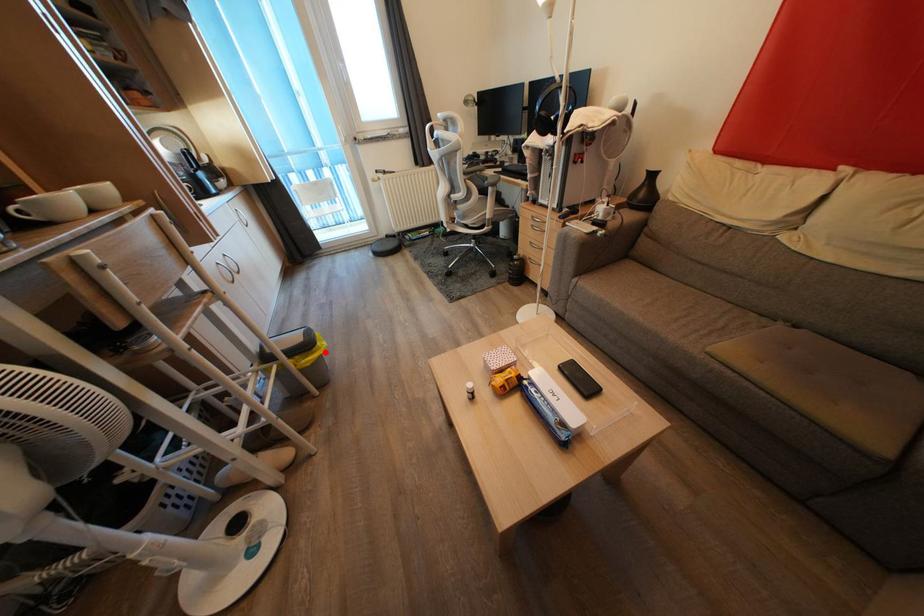
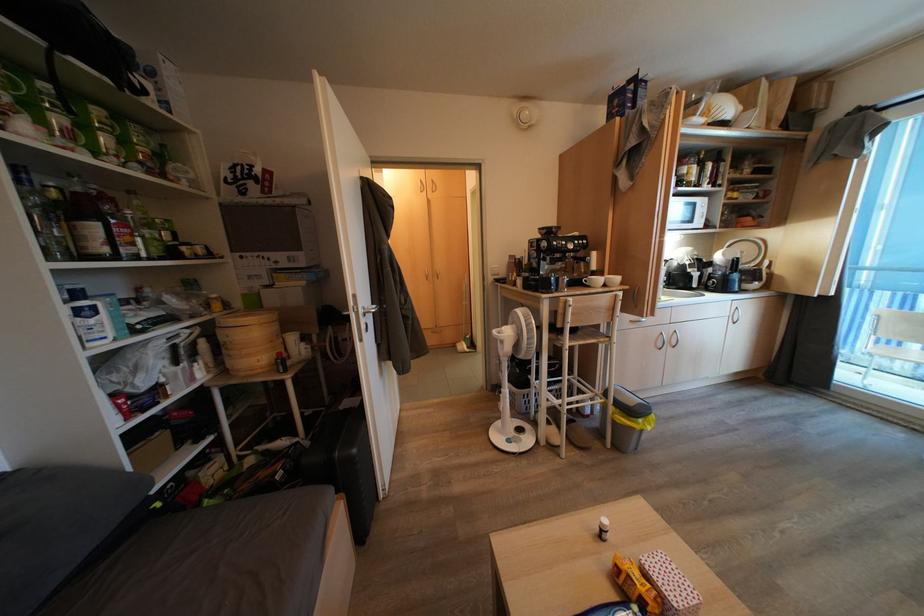
The point at the highlighted location is marked in the first image. Where is the corresponding point in the second image?

(642, 428)